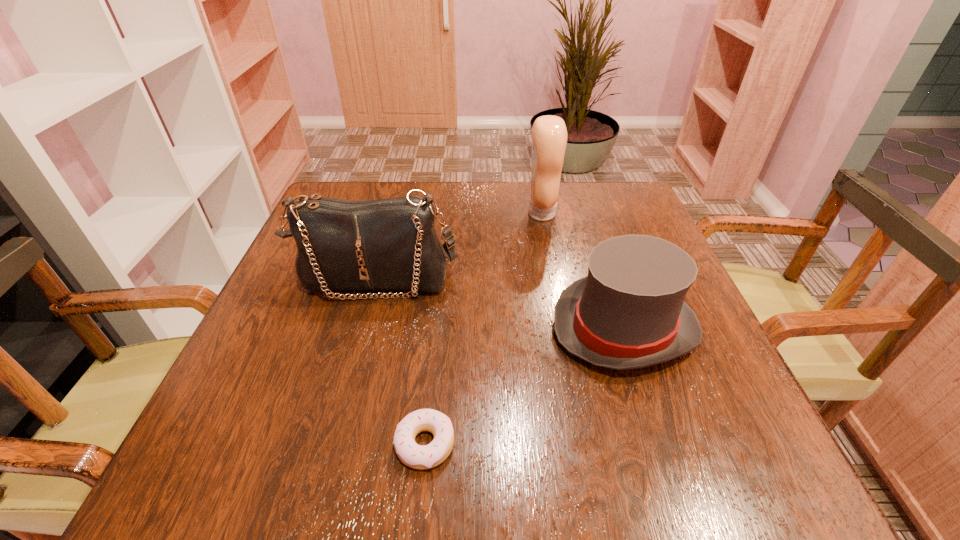
The image size is (960, 540). I want to click on vacant space situated on the back of the shortest object, so click(x=431, y=380).

This screenshot has width=960, height=540. I want to click on object positioned at the far edge, so click(549, 133).

The height and width of the screenshot is (540, 960). Identify the location of object at the near edge. (421, 457).

Image resolution: width=960 pixels, height=540 pixels. I want to click on object at the left edge, so click(x=385, y=244).

Locate an element on the screen. The width and height of the screenshot is (960, 540). object that is positioned at the right edge is located at coordinates (629, 312).

At what (x,y) coordinates should I click in order to perform the action: click on free space at the far edge of the desktop. Please return your answer as a coordinate pair (x, y). This screenshot has width=960, height=540. Looking at the image, I should click on (482, 226).

You are a GUI agent. You are given a task and a screenshot of the screen. Output one action in this format:
    pyautogui.click(x=<x>, y=<y>)
    Task: Click on the vacant space at the left edge of the desktop
    
    Given the screenshot: What is the action you would take?
    pyautogui.click(x=214, y=416)

You are a GUI agent. You are given a task and a screenshot of the screen. Output one action in this format:
    pyautogui.click(x=<x>, y=<y>)
    Task: Click on the vacant region at the far left corner of the desktop
    
    Given the screenshot: What is the action you would take?
    click(350, 192)

The width and height of the screenshot is (960, 540). I want to click on vacant space at the near left corner of the desktop, so click(279, 446).

Where is `free location at the far right corner of the desktop`? The height and width of the screenshot is (540, 960). free location at the far right corner of the desktop is located at coordinates (575, 185).